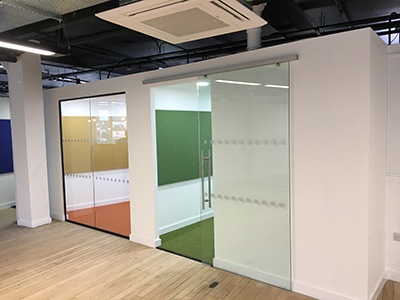
This screenshot has height=300, width=400. I want to click on handle, so click(203, 159).